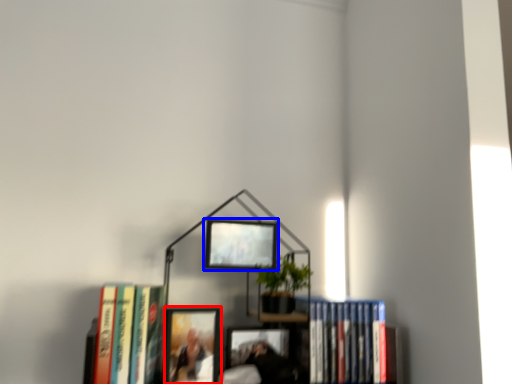
Question: Which of the following is the closest to the observer, picture frame (highlighted by a red box) or picture frame (highlighted by a blue box)?

Choices:
 (A) picture frame
 (B) picture frame

Answer: (A)